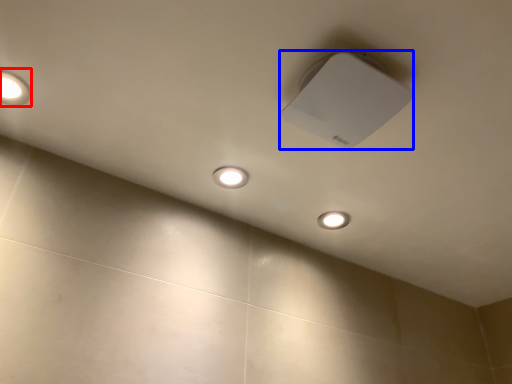
Question: Which object is closer to the camera taking this photo, lamp (highlighted by a red box) or lamp (highlighted by a blue box)?

Choices:
 (A) lamp
 (B) lamp

Answer: (B)